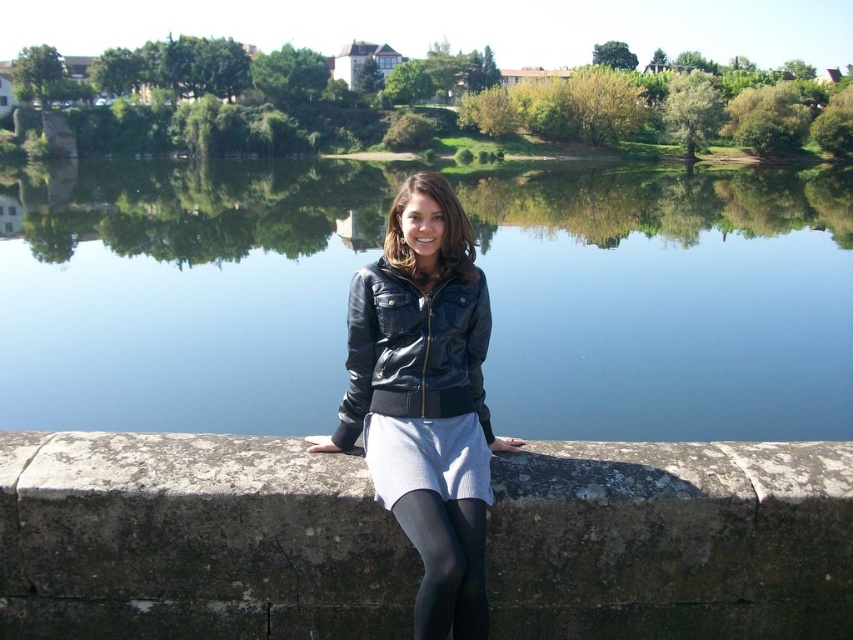
Between leather jacket at center and black tights at lower center, which one has more height?

Standing taller between the two is leather jacket at center.

Which is more to the right, leather jacket at center or black tights at lower center?

black tights at lower center is more to the right.

This screenshot has height=640, width=853. What do you see at coordinates (425, 400) in the screenshot?
I see `leather jacket at center` at bounding box center [425, 400].

Identify the location of leather jacket at center. This screenshot has width=853, height=640. (425, 400).

Between point (160, 413) and point (372, 298), which one is positioned in front?

Point (372, 298) is in front.

Is point (254, 275) closer to viewer compared to point (412, 534)?

No, (254, 275) is behind (412, 534).

You are a GUI agent. You are given a task and a screenshot of the screen. Output one action in this format:
    pyautogui.click(x=<x>, y=<y>)
    Task: Click on the transparent blue water at center
    
    Given the screenshot: What is the action you would take?
    pyautogui.click(x=668, y=301)

Between point (270, 570) and point (456, 300), which one is positioned in front?

Point (270, 570) is in front.

Does point (135, 634) come in front of point (469, 499)?

No, (135, 634) is behind (469, 499).

I want to click on smooth concrete ledge at center, so click(194, 540).